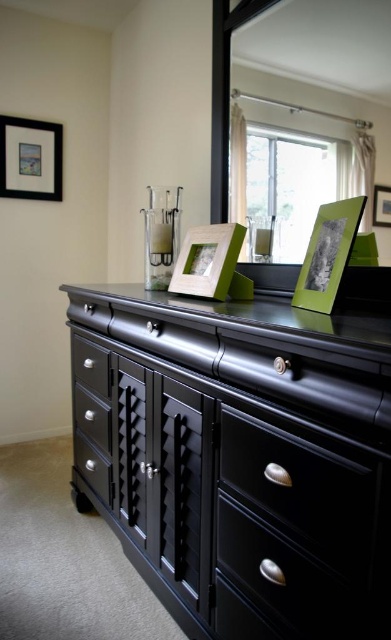
Where is `matte black dresser at center`? matte black dresser at center is located at coordinates (242, 460).

Is matte black dresser at center positioned before green matte picture frame at right?

Yes, matte black dresser at center is closer to the viewer.

Does point (200, 483) come closer to viewer compared to point (294, 296)?

Yes, it is.

Identify the location of matte black dresser at center. (242, 460).

Is matte black mirror at upper center further to camera compared to matte black drawer at lower left?

No.

Does point (340, 141) lie behind point (93, 381)?

No, (340, 141) is in front of (93, 381).

Locate an element on the screen. matte black mirror at upper center is located at coordinates (299, 109).

Does matte black mirror at upper center appear on the left side of green matte picture frame at upper center?

Yes, matte black mirror at upper center is to the left of green matte picture frame at upper center.

Is point (362, 172) farther from camera compared to point (389, 209)?

Yes, it is behind point (389, 209).

Is point (331, 182) in front of point (389, 188)?

No.

The height and width of the screenshot is (640, 391). Identify the location of matte black mirror at upper center. (299, 109).